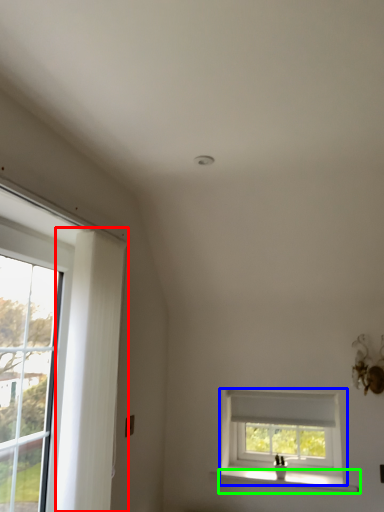
Question: Estimate the real-world distances between objects in this image. Which object is closer to curtain (highlighted by a red box), window (highlighted by a blue box) or window sill (highlighted by a green box)?

Choices:
 (A) window
 (B) window sill

Answer: (A)